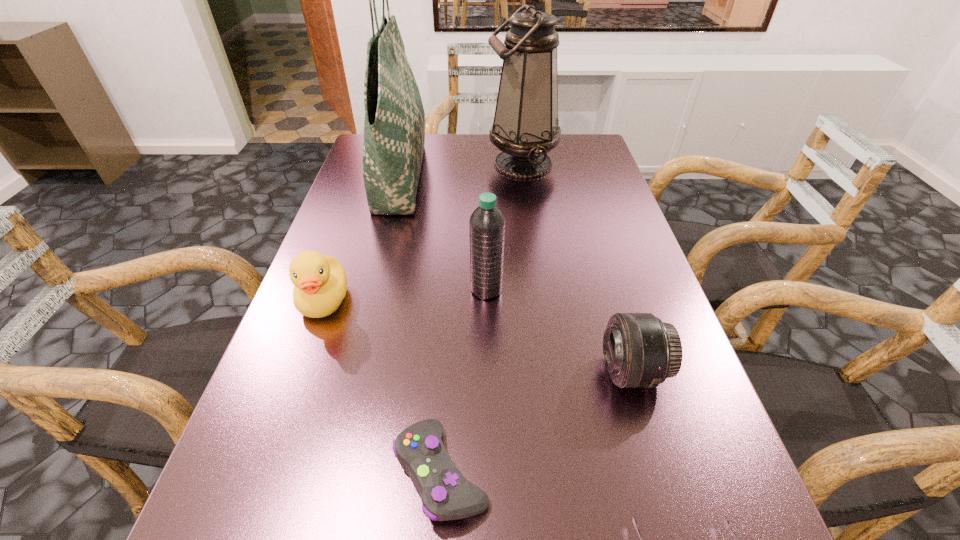
Locate an element on the screen. Image resolution: width=960 pixels, height=540 pixels. object positioned at the far left corner is located at coordinates click(394, 128).

Identify the location of object at the far right corner. (525, 128).

The image size is (960, 540). I want to click on vacant space at the far edge, so click(485, 151).

At what (x,y) coordinates should I click in order to perform the action: click on blank space at the left edge of the desktop. Please return your answer as a coordinate pair (x, y). Looking at the image, I should click on (351, 251).

The width and height of the screenshot is (960, 540). In the image, there is a desktop. Find the location of `free region at the right edge`. free region at the right edge is located at coordinates (625, 298).

Image resolution: width=960 pixels, height=540 pixels. Identify the location of vacant area at the far right corner. (573, 167).

At what (x,y) coordinates should I click in order to perform the action: click on free space between the control and the third nearest object. Please return your answer as a coordinate pair (x, y). This screenshot has width=960, height=540. Looking at the image, I should click on (537, 422).

Locate an element on the screen. This screenshot has width=960, height=540. free point between the third nearest object and the sixth shortest object is located at coordinates (577, 268).

The width and height of the screenshot is (960, 540). I want to click on empty location between the tallest object and the fifth farthest object, so click(516, 273).

This screenshot has width=960, height=540. I want to click on blank region between the duck and the control, so click(383, 386).